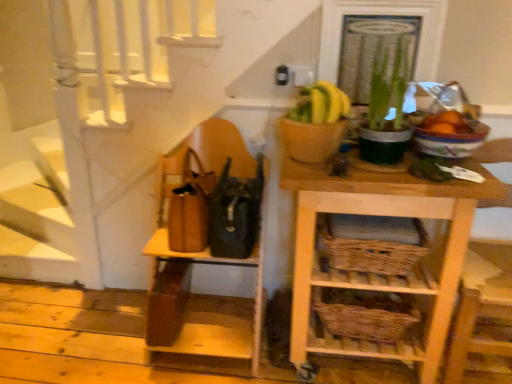
The width and height of the screenshot is (512, 384). Identify the location of woven brown basket at lower center, acting as the 1th basket starting from the bottom. (365, 313).

This screenshot has height=384, width=512. Describe the element at coordinates (234, 213) in the screenshot. I see `black leather bag at center` at that location.

Locate an element on the screen. light wood wicker basket at center right, the 1th shelf viewed from the right is located at coordinates (387, 276).

What are the coordinates of `green leafy plant at upper right` in the screenshot? It's located at (387, 103).

Considering the relative sizes of brown leather shelf at left, the 2th shelf from the right, and light wood wicker basket at center right, which ranks as the 2th shelf in left-to-right order, in the image provided, is brown leather shelf at left, the 2th shelf from the right, wider than light wood wicker basket at center right, which ranks as the 2th shelf in left-to-right order,?

No, brown leather shelf at left, the 2th shelf from the right, is not wider than light wood wicker basket at center right, which ranks as the 2th shelf in left-to-right order.

From the image's perspective, which object appears higher, brown leather shelf at left, which is the 1th shelf in left-to-right order, or light wood wicker basket at center right, which ranks as the 2th shelf in left-to-right order?

brown leather shelf at left, which is the 1th shelf in left-to-right order, from the image's perspective.

Is brown leather shelf at left, which is the 1th shelf in left-to-right order, in front of or behind light wood wicker basket at center right, the 1th shelf viewed from the right, in the image?

In the image, brown leather shelf at left, which is the 1th shelf in left-to-right order, appears behind light wood wicker basket at center right, the 1th shelf viewed from the right.

How many degrees apart are the facing directions of brown leather shelf at left, which is the 1th shelf in left-to-right order, and light wood wicker basket at center right, which ranks as the 2th shelf in left-to-right order?

The angle between the facing direction of brown leather shelf at left, which is the 1th shelf in left-to-right order, and the facing direction of light wood wicker basket at center right, which ranks as the 2th shelf in left-to-right order, is 0.501 degrees.

Considering the sizes of objects woven brown basket at lower center, which is the first basket from top to bottom, and black leather bag at center in the image provided, who is shorter, woven brown basket at lower center, which is the first basket from top to bottom, or black leather bag at center?

woven brown basket at lower center, which is the first basket from top to bottom.

Does woven brown basket at lower center, which is the first basket from top to bottom, have a smaller size compared to black leather bag at center?

Actually, woven brown basket at lower center, which is the first basket from top to bottom, might be larger than black leather bag at center.

From a real-world perspective, between woven brown basket at lower center, which is the first basket from top to bottom, and black leather bag at center, who is vertically higher?

black leather bag at center.

In order to click on bag that is above the woven brown basket at lower center, which is the first basket from top to bottom (from a real-world perspective) in this screenshot , I will do `click(234, 213)`.

Is woven brown basket at lower center, which is the second basket from top to bottom, not within green leafy plant at upper right?

Indeed, woven brown basket at lower center, which is the second basket from top to bottom, is completely outside green leafy plant at upper right.

How far apart are woven brown basket at lower center, acting as the 1th basket starting from the bottom, and green leafy plant at upper right?

26.04 inches.

Relative to green leafy plant at upper right, is woven brown basket at lower center, which is the second basket from top to bottom, in front or behind?

In the image, woven brown basket at lower center, which is the second basket from top to bottom, appears behind green leafy plant at upper right.

In terms of height, does woven brown basket at lower center, acting as the 1th basket starting from the bottom, look taller or shorter compared to green leafy plant at upper right?

Clearly, woven brown basket at lower center, acting as the 1th basket starting from the bottom, is shorter compared to green leafy plant at upper right.

Is brown leather shelf at left, which is the 1th shelf in left-to-right order, smaller than wooden chair at right?

Yes.

From a real-world perspective, is brown leather shelf at left, the 2th shelf from the right, physically located above or below wooden chair at right?

In terms of real-world spatial position, brown leather shelf at left, the 2th shelf from the right, is below wooden chair at right.

Is brown leather shelf at left, which is the 1th shelf in left-to-right order, placed right next to wooden chair at right?

No, brown leather shelf at left, which is the 1th shelf in left-to-right order, is not beside wooden chair at right.

Can you tell me how much green leafy plant at upper right and woven brown basket at lower center, which is the second basket from top to bottom, differ in facing direction?

The angular difference between green leafy plant at upper right and woven brown basket at lower center, which is the second basket from top to bottom, is 0.724 degrees.

Considering the relative sizes of green leafy plant at upper right and woven brown basket at lower center, which is the second basket from top to bottom, in the image provided, is green leafy plant at upper right shorter than woven brown basket at lower center, which is the second basket from top to bottom,?

No, green leafy plant at upper right is not shorter than woven brown basket at lower center, which is the second basket from top to bottom.

From a real-world perspective, who is located lower, green leafy plant at upper right or woven brown basket at lower center, which is the second basket from top to bottom?

In real-world perspective, woven brown basket at lower center, which is the second basket from top to bottom, is lower.

Is green leafy plant at upper right far away from woven brown basket at lower center, acting as the 1th basket starting from the bottom?

green leafy plant at upper right is near woven brown basket at lower center, acting as the 1th basket starting from the bottom, not far away.

From the image's perspective, is green leafy plant at upper right located beneath black leather bag at center?

No, from the image's perspective, green leafy plant at upper right is not beneath black leather bag at center.

From a real-world perspective, which is physically below, green leafy plant at upper right or black leather bag at center?

From a 3D spatial view, black leather bag at center is below.

Considering the positions of objects green leafy plant at upper right and black leather bag at center in the image provided, who is more to the right, green leafy plant at upper right or black leather bag at center?

green leafy plant at upper right is more to the right.

The width and height of the screenshot is (512, 384). What are the coordinates of `chair that appears on the right of light wood wicker basket at center right, which ranks as the 2th shelf in left-to-right order` in the screenshot? It's located at (461, 336).

Can you confirm if light wood wicker basket at center right, the 1th shelf viewed from the right, is taller than wooden chair at right?

Incorrect, the height of light wood wicker basket at center right, the 1th shelf viewed from the right, is not larger of that of wooden chair at right.

Is wooden chair at right a part of light wood wicker basket at center right, the 1th shelf viewed from the right?

No, wooden chair at right is not inside light wood wicker basket at center right, the 1th shelf viewed from the right.

From the image's perspective, which is above, light wood wicker basket at center right, the 1th shelf viewed from the right, or wooden chair at right?

wooden chair at right is shown above in the image.

This screenshot has height=384, width=512. I want to click on shelf in front of the brown leather shelf at left, which is the 1th shelf in left-to-right order, so click(x=387, y=276).

From the image's perspective, starting from the black leather bag at center, which basket is the 1st one below? Please provide its 2D coordinates.

[(371, 243)]

From the image, which object appears to be nearer to black leather bag at center, woven brown basket at lower center, which appears as the second basket when ordered from the bottom, or woven brown basket at lower center, acting as the 1th basket starting from the bottom?

Among the two, woven brown basket at lower center, which appears as the second basket when ordered from the bottom, is located nearer to black leather bag at center.

Based on their spatial positions, is woven brown basket at lower center, which is the second basket from top to bottom, or black leather bag at center further from light wood wicker basket at center right, the 1th shelf viewed from the right?

Among the two, black leather bag at center is located further to light wood wicker basket at center right, the 1th shelf viewed from the right.

Consider the image. Which object lies nearer to the anchor point black leather bag at center, woven brown basket at lower center, which appears as the second basket when ordered from the bottom, or wooden chair at right?

Based on the image, woven brown basket at lower center, which appears as the second basket when ordered from the bottom, appears to be nearer to black leather bag at center.

Based on their spatial positions, is green leafy plant at upper right or black leather bag at center closer to brown leather shelf at left, which is the 1th shelf in left-to-right order?

black leather bag at center is closer to brown leather shelf at left, which is the 1th shelf in left-to-right order.

When comparing their distances from wooden chair at right, does brown leather shelf at left, the 2th shelf from the right, or green leafy plant at upper right seem further?

brown leather shelf at left, the 2th shelf from the right.

Looking at the image, which one is located closer to woven brown basket at lower center, acting as the 1th basket starting from the bottom, wooden chair at right or light wood wicker basket at center right, which ranks as the 2th shelf in left-to-right order?

The object closer to woven brown basket at lower center, acting as the 1th basket starting from the bottom, is light wood wicker basket at center right, which ranks as the 2th shelf in left-to-right order.

When comparing their distances from black leather bag at center, does brown leather shelf at left, the 2th shelf from the right, or woven brown basket at lower center, which is the second basket from top to bottom, seem closer?

brown leather shelf at left, the 2th shelf from the right, lies closer to black leather bag at center than the other object.

Looking at the image, which one is located further to woven brown basket at lower center, which is the first basket from top to bottom, green leafy plant at upper right or black leather bag at center?

black leather bag at center is further to woven brown basket at lower center, which is the first basket from top to bottom.

Find the location of a particular element. Image resolution: width=512 pixels, height=384 pixels. houseplant between black leather bag at center and woven brown basket at lower center, which appears as the second basket when ordered from the bottom is located at coordinates (387, 103).

The height and width of the screenshot is (384, 512). I want to click on basket between black leather bag at center and woven brown basket at lower center, which is the first basket from top to bottom, from left to right, so click(x=365, y=313).

I want to click on bag between brown leather shelf at left, the 2th shelf from the right, and woven brown basket at lower center, which is the first basket from top to bottom, so click(x=234, y=213).

You are a GUI agent. You are given a task and a screenshot of the screen. Output one action in this format:
    pyautogui.click(x=<x>, y=<y>)
    Task: Click on the bag situated between brown leather shelf at left, the 2th shelf from the right, and woven brown basket at lower center, which is the second basket from top to bottom, from left to right
    The height and width of the screenshot is (384, 512).
    Given the screenshot: What is the action you would take?
    pyautogui.click(x=234, y=213)